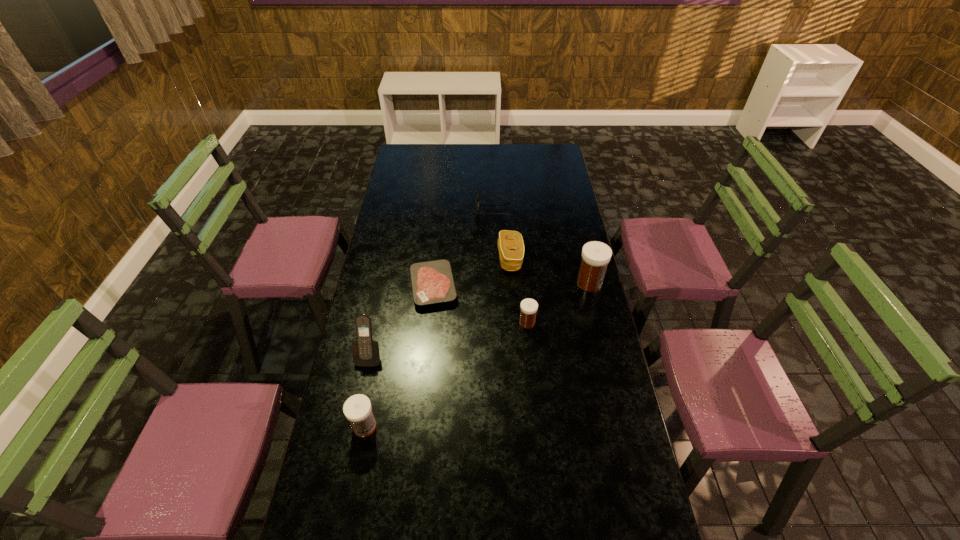
Please point a spot to place another medicine for symmetrical spacing. Please provide its 2D coordinates. Your answer should be formatted as a tuple, i.e. [(x, y)], where the tuple contains the x and y coordinates of a point satisfying the conditions above.

[(453, 369)]